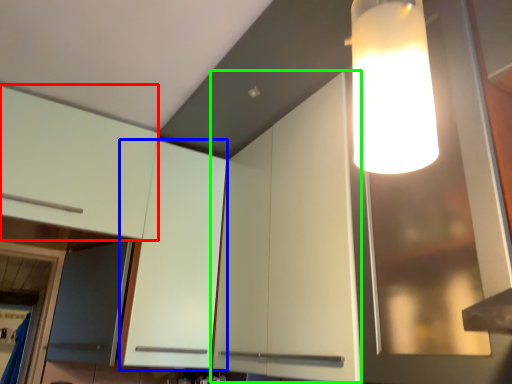
Question: Which object is the farthest from cabinetry (highlighted by a red box)? Choose among these: cabinetry (highlighted by a blue box) or cabinetry (highlighted by a green box).

Choices:
 (A) cabinetry
 (B) cabinetry

Answer: (B)